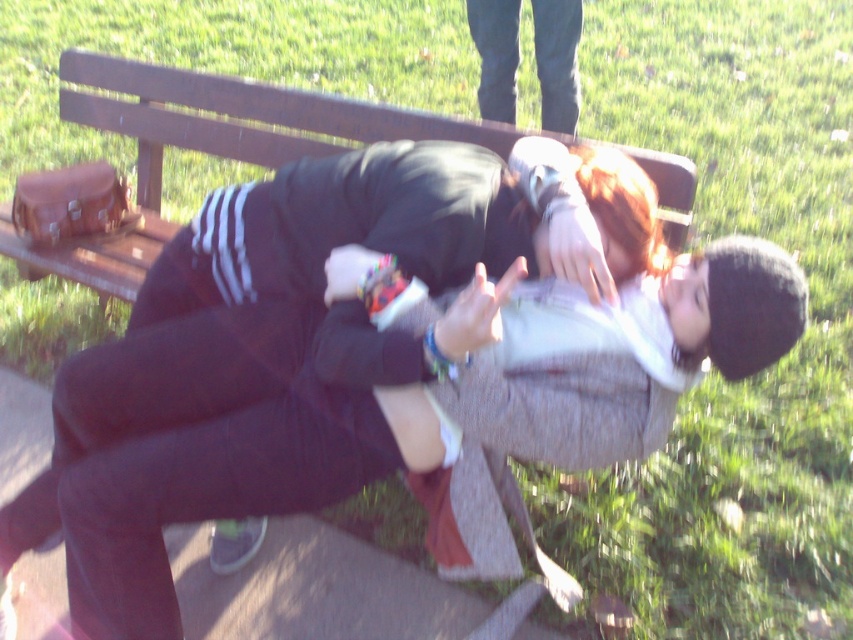
Question: Can you confirm if wooden bench at center is positioned to the left of dark blue jeans at upper center?

Choices:
 (A) no
 (B) yes

Answer: (B)

Question: Among these points, which one is nearest to the camera?

Choices:
 (A) (515, 10)
 (B) (251, 88)

Answer: (B)

Question: Can you confirm if wooden bench at center is positioned to the left of dark blue jeans at upper center?

Choices:
 (A) yes
 (B) no

Answer: (A)

Question: Where is wooden bench at center located in relation to dark blue jeans at upper center in the image?

Choices:
 (A) right
 (B) left

Answer: (B)

Question: Which of the following is the farthest from the observer?

Choices:
 (A) wooden bench at center
 (B) dark blue jeans at upper center

Answer: (B)